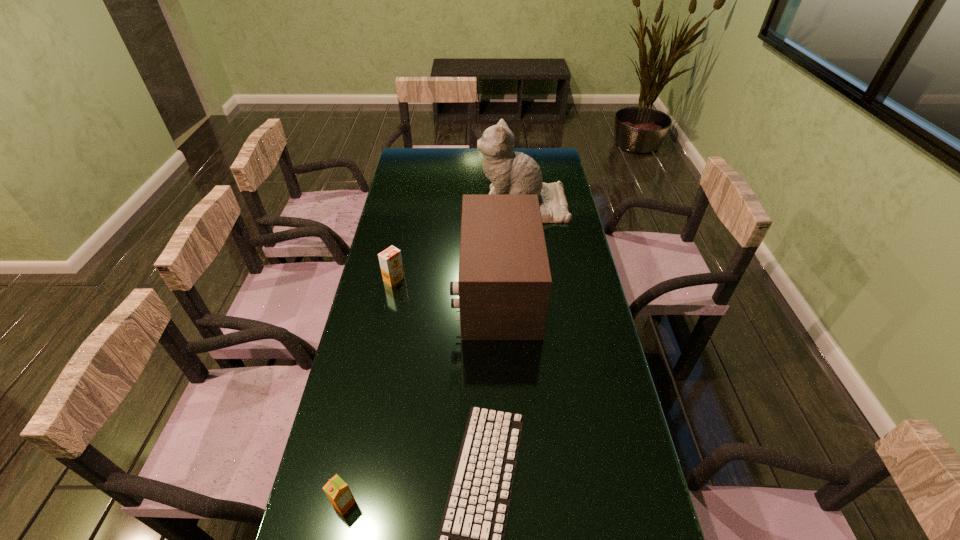
In the image, there is a desktop. Identify the location of vacant space at the far right corner. (542, 163).

This screenshot has width=960, height=540. Find the location of `free spot between the second shortest object and the radio receiver`. free spot between the second shortest object and the radio receiver is located at coordinates (420, 397).

Identify the location of vacant area between the cat and the second shortest object. (433, 355).

The image size is (960, 540). Find the location of `free space between the tallest object and the shorter orange juice`. free space between the tallest object and the shorter orange juice is located at coordinates (433, 355).

Identify the location of empty location between the farthest object and the nearer orange juice. (433, 355).

You are a GUI agent. You are given a task and a screenshot of the screen. Output one action in this format:
    pyautogui.click(x=<x>, y=<y>)
    Task: Click on the free spot between the fourth shortest object and the nearer orange juice
    The height and width of the screenshot is (540, 960).
    Given the screenshot: What is the action you would take?
    pyautogui.click(x=420, y=397)

Choose which object is the third nearest neighbor to the farthest object. Please provide its 2D coordinates. Your answer should be formatted as a tuple, i.e. [(x, y)], where the tuple contains the x and y coordinates of a point satisfying the conditions above.

[(470, 539)]

Locate which object ranks third in proximity to the nearer orange juice. Please provide its 2D coordinates. Your answer should be formatted as a tuple, i.e. [(x, y)], where the tuple contains the x and y coordinates of a point satisfying the conditions above.

[(390, 259)]